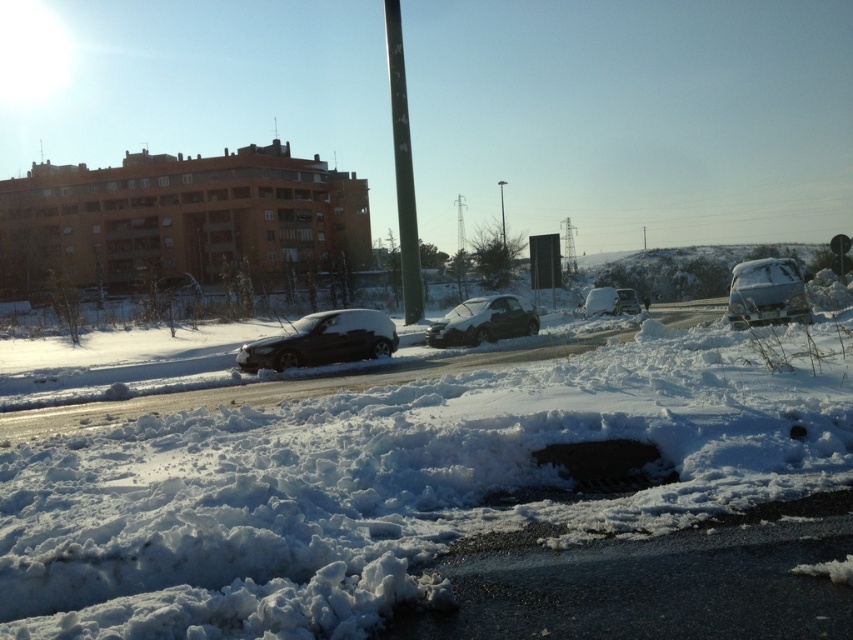
Question: Which of the following is the closest to the observer?

Choices:
 (A) (621, 301)
 (B) (502, 337)
 (C) (305, 336)

Answer: (C)

Question: Is glossy black car at center-left closer to the viewer compared to green matte pole at center?

Choices:
 (A) no
 (B) yes

Answer: (B)

Question: Can you confirm if white fluffy snow at center is positioned to the right of glossy silver car at right?

Choices:
 (A) yes
 (B) no

Answer: (B)

Question: Is white fluffy snow at center to the left of green matte pole at center from the viewer's perspective?

Choices:
 (A) yes
 (B) no

Answer: (B)

Question: Estimate the real-world distances between objects in this image. Which object is farther from the sleek silver sedan at center?

Choices:
 (A) white fluffy snow at center
 (B) green matte pole at center
 (C) glossy black car at center-left
 (D) white matte van at center-right

Answer: (B)

Question: Which point is closer to the camera?

Choices:
 (A) (350, 577)
 (B) (633, 307)

Answer: (A)